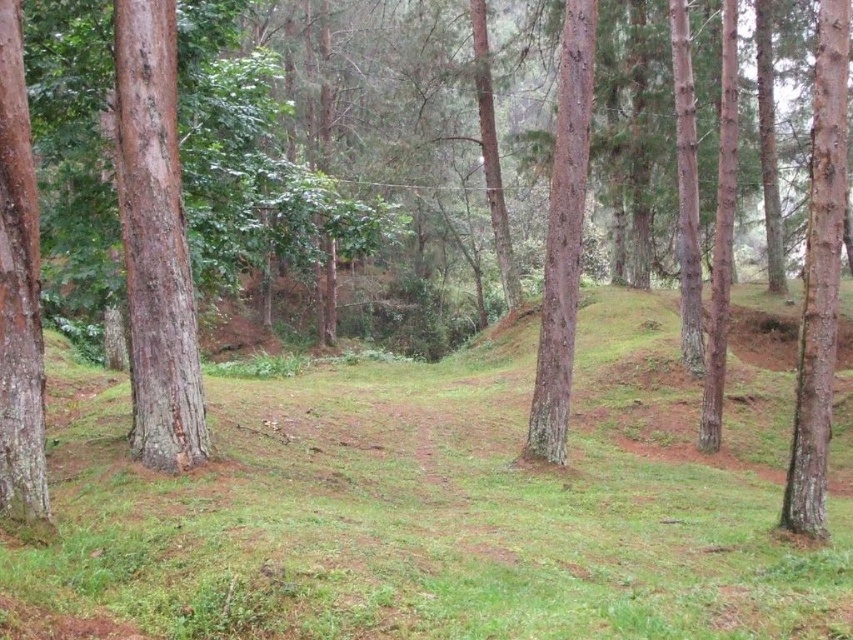
The width and height of the screenshot is (853, 640). What do you see at coordinates (18, 292) in the screenshot? I see `smooth brown tree trunk at left` at bounding box center [18, 292].

Identify the location of smooth brown tree trunk at left. This screenshot has width=853, height=640. (18, 292).

In the scene shown: Is the position of brown rough bark tree at left less distant than that of smooth brown tree trunk at left?

No, brown rough bark tree at left is further to the viewer.

Does point (149, 392) come farther from viewer compared to point (20, 346)?

Yes, it is behind point (20, 346).

Who is more distant from viewer, (x=142, y=76) or (x=10, y=369)?

Point (x=142, y=76)

The width and height of the screenshot is (853, 640). What are the coordinates of `brown rough bark tree at left` in the screenshot? It's located at (155, 243).

Does green grassy at center appear over smooth bark tree at right?

Actually, green grassy at center is below smooth bark tree at right.

Is point (180, 602) behind point (827, 291)?

No, it is in front of (827, 291).

Is point (225, 388) in front of point (833, 320)?

No.

Where is `green grassy at center`? This screenshot has height=640, width=853. green grassy at center is located at coordinates click(439, 502).